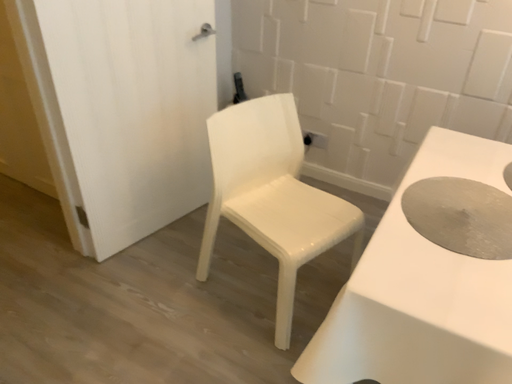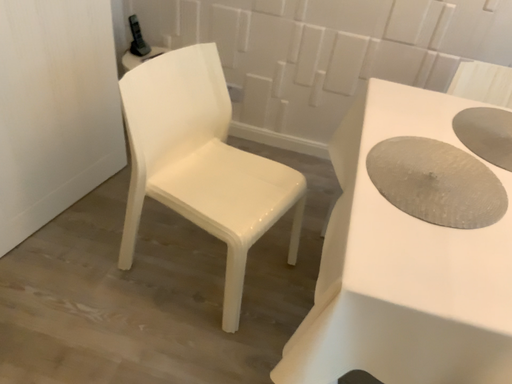
Question: How did the camera likely rotate when shooting the video?

Choices:
 (A) rotated right
 (B) rotated left

Answer: (A)